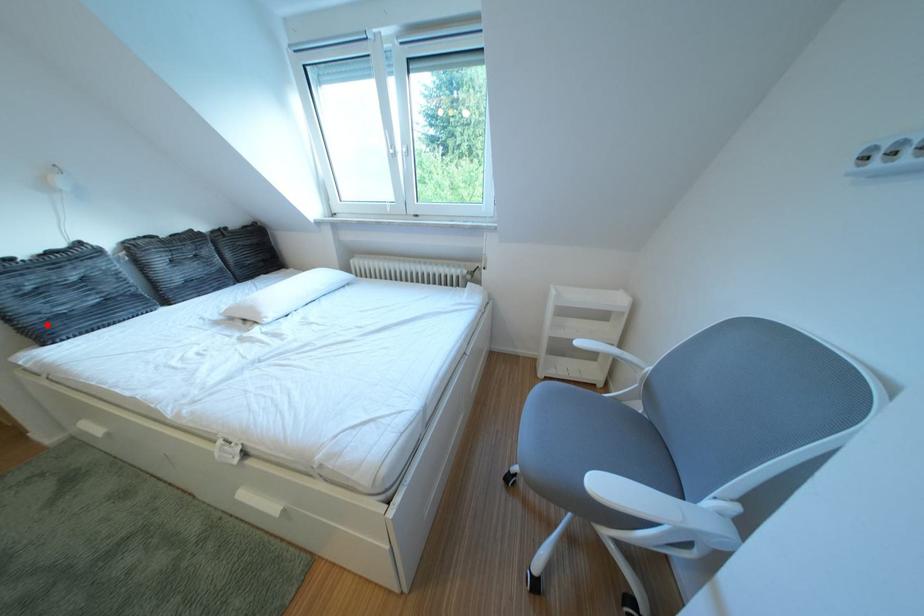
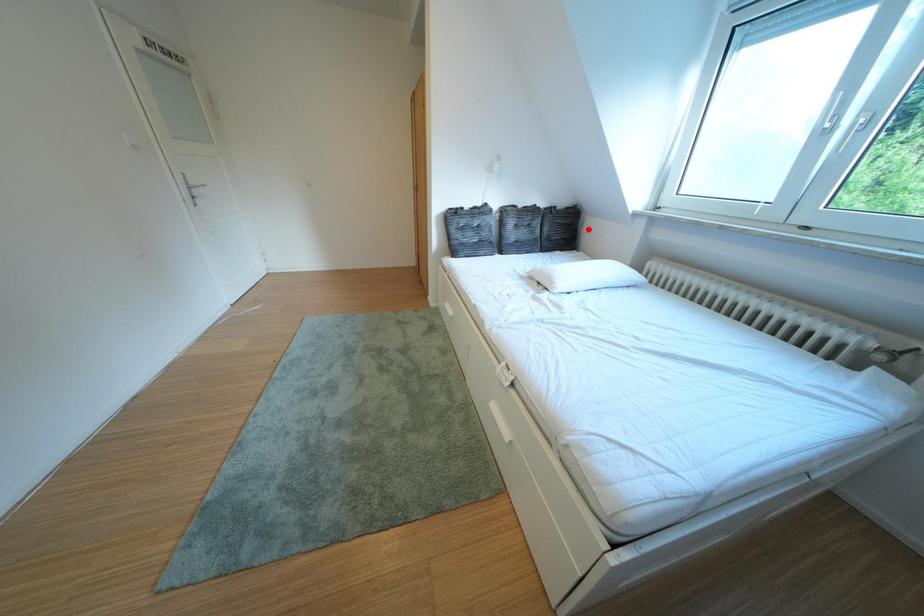
I am providing you with two images of the same scene from different viewpoints. A red point is marked on the first image and another point is marked on the second image. Does the point marked in image1 correspond to the same location as the one in image2?

No